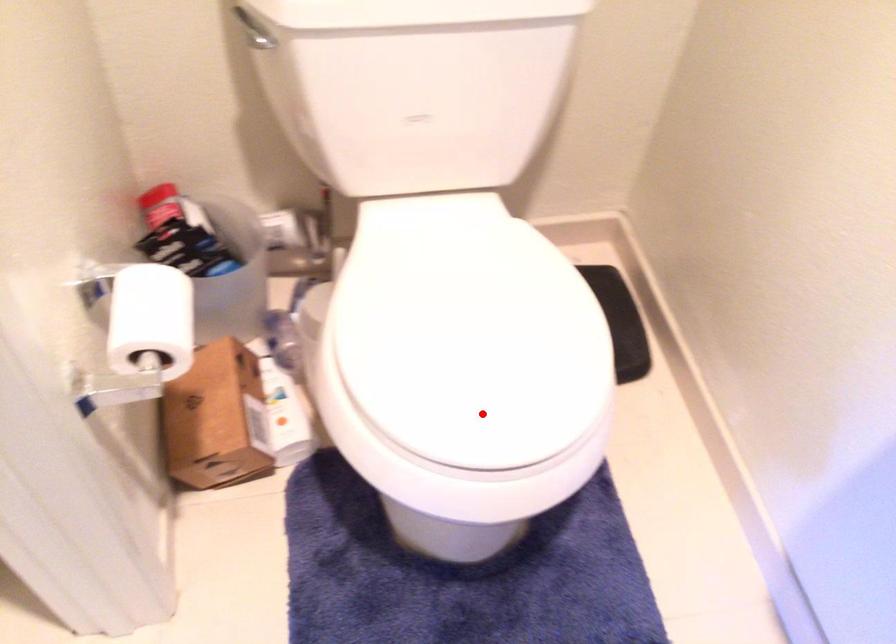
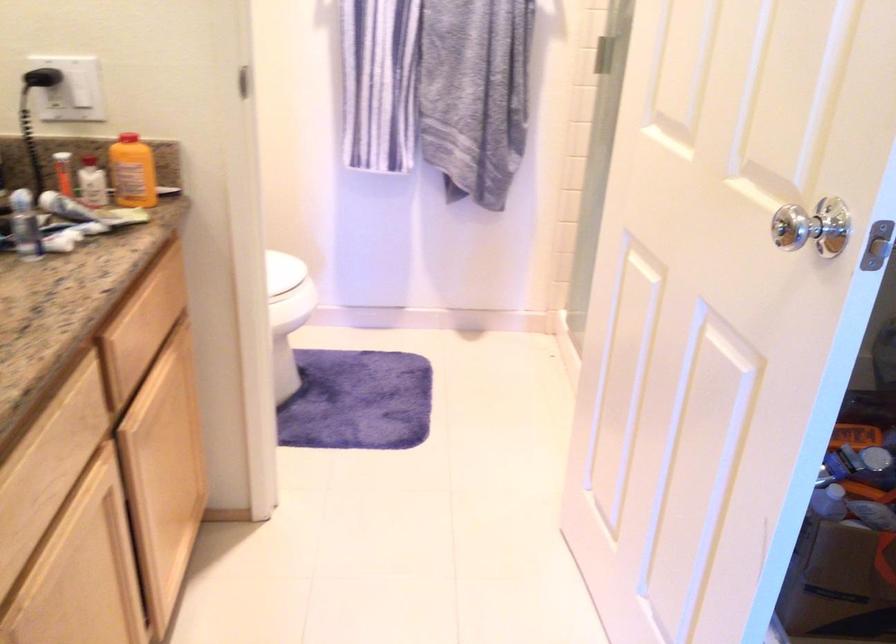
The point at the highlighted location is marked in the first image. Where is the corresponding point in the second image?

(282, 270)